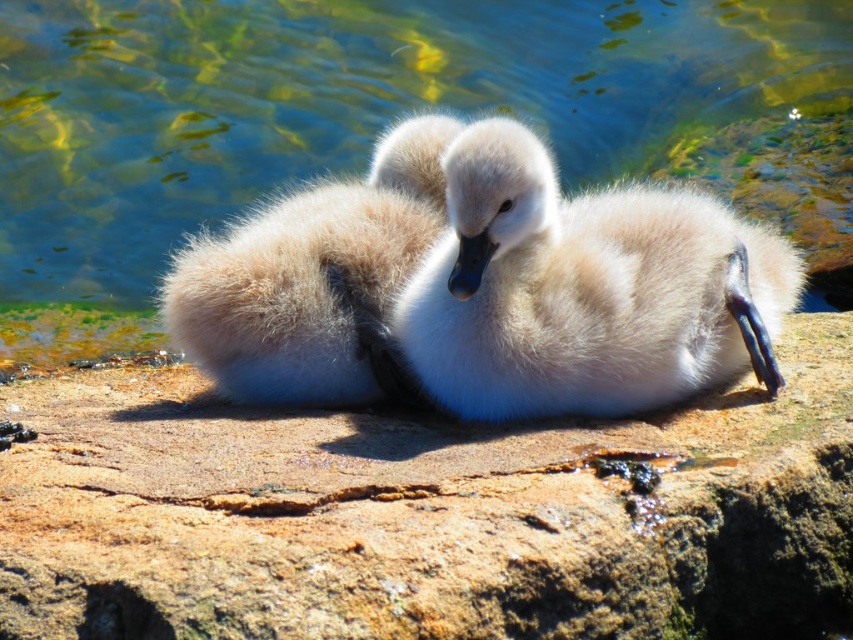
Question: Which object is the closest to the brown rough stone at center?

Choices:
 (A) white fluffy duckling at center
 (B) fluffy white goose at center

Answer: (A)

Question: Can you confirm if translucent water at center is positioned below fluffy white goose at center?

Choices:
 (A) no
 (B) yes

Answer: (A)

Question: Does brown rough stone at center appear under fluffy white goose at center?

Choices:
 (A) yes
 (B) no

Answer: (A)

Question: Among these objects, which one is farthest from the camera?

Choices:
 (A) fluffy white goose at center
 (B) white fluffy duckling at center

Answer: (A)

Question: Among these objects, which one is nearest to the camera?

Choices:
 (A) fluffy white goose at center
 (B) translucent water at center

Answer: (A)

Question: Is brown rough stone at center to the left of white fluffy duckling at center from the viewer's perspective?

Choices:
 (A) yes
 (B) no

Answer: (A)